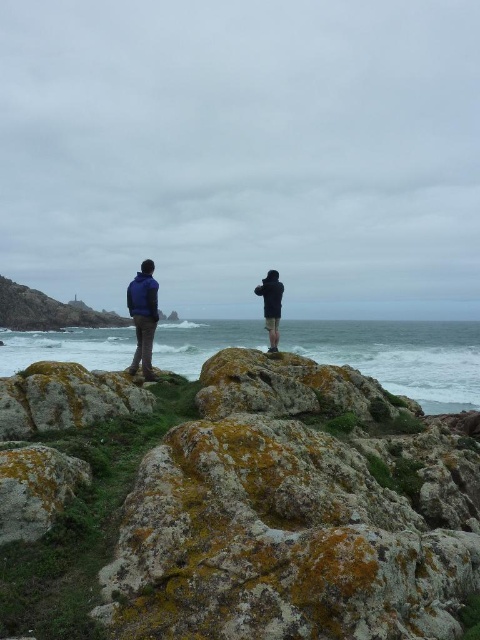
You are standing on the green mossy rock at center and want to move to the white frothy water at center. Which direction should you move to reach it?

The white frothy water at center is on the right side of the green mossy rock at center, so you should move to the right to reach it.

You are a photographer trying to capture a shot of the green mossy rock at center and the dark blue jacket at center in the same frame. Given that your camera has a maximum focus range of 5 meters, will you be able to focus on both subjects simultaneously?

The green mossy rock at center and dark blue jacket at center are 5.07 meters apart from each other. Since the distance between them exceeds the camera maximum focus range of 5 meters, the camera cannot focus on both subjects simultaneously.